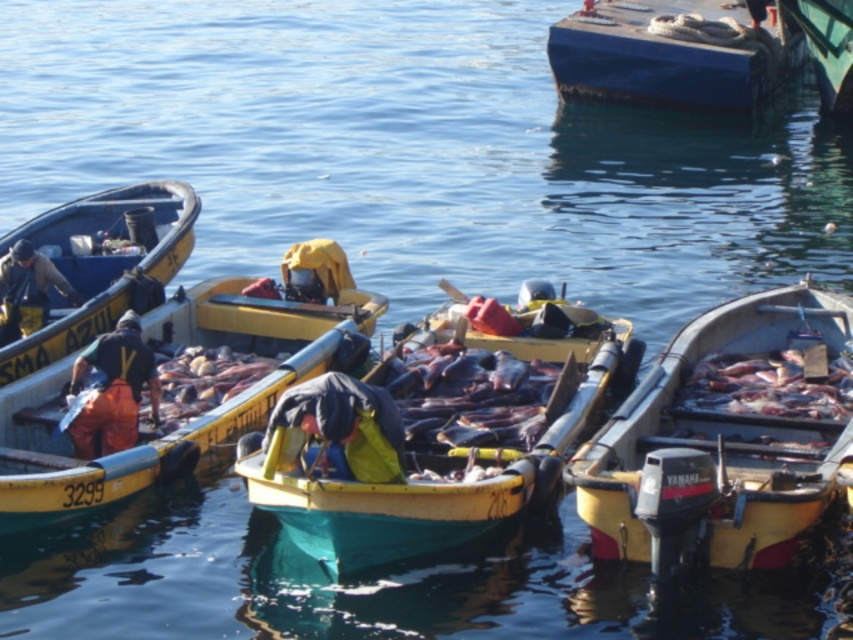
Question: Among these points, which one is nearest to the camera?

Choices:
 (A) (85, 353)
 (B) (73, 301)

Answer: (A)

Question: Does teal wooden boat at center appear over green matte boat at upper right?

Choices:
 (A) no
 (B) yes

Answer: (A)

Question: Is yellow plastic boat at center smaller than yellow matte boat at left?

Choices:
 (A) no
 (B) yes

Answer: (A)

Question: Can you confirm if smooth blue hull at upper right is thinner than orange fabric bag at left?

Choices:
 (A) yes
 (B) no

Answer: (B)

Question: Which point appears closest to the camera in this image?

Choices:
 (A) (16, 282)
 (B) (131, 214)
 (C) (634, 528)

Answer: (C)

Question: Which point is closer to the camera?

Choices:
 (A) yellow matte boat at lower right
 (B) smooth blue hull at upper right

Answer: (A)